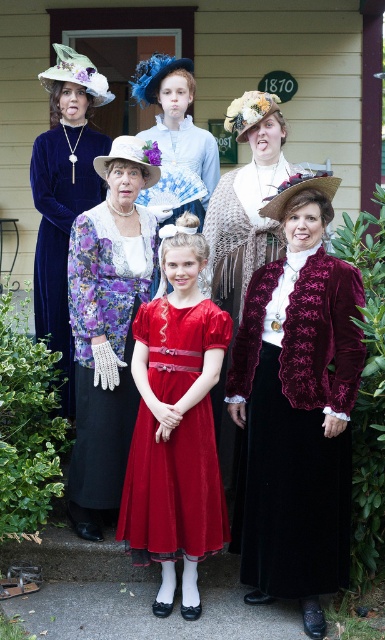
You are a photographer at the historical reenactment event. You need to adjust the lighting so that the velvet burgundy jacket at center and the velvet dress at upper left are both well lit. Based on their positions, which object is closer to the ground and might need a lower light source?

The velvet burgundy jacket at center is located below the velvet dress at upper left, so it is closer to the ground and would require a lower light source.